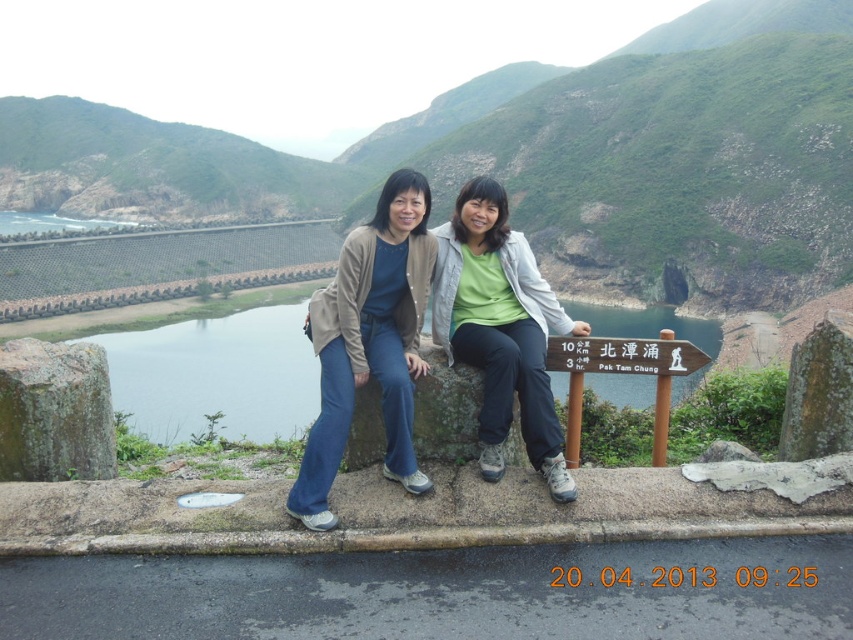
Which is more to the right, green fabric jacket at center or brown wooden signpost at center?

From the viewer's perspective, brown wooden signpost at center appears more on the right side.

Measure the distance from green fabric jacket at center to brown wooden signpost at center.

1.27 meters

Locate an element on the screen. This screenshot has height=640, width=853. green fabric jacket at center is located at coordinates (500, 328).

The width and height of the screenshot is (853, 640). Identify the location of green fabric jacket at center. (500, 328).

Does point (340, 262) come closer to viewer compared to point (83, 472)?

No, it is not.

Between point (540, 339) and point (3, 356), which one is positioned behind?

The point (540, 339) is behind.

Image resolution: width=853 pixels, height=640 pixels. In order to click on denim jeans at center in this screenshot , I will do `click(370, 342)`.

You are a GUI agent. You are given a task and a screenshot of the screen. Output one action in this format:
    pyautogui.click(x=<x>, y=<y>)
    Task: Click on the matte brown cardigan at center
    The height and width of the screenshot is (640, 853).
    Given the screenshot: What is the action you would take?
    pyautogui.click(x=369, y=342)

Does matte brown cardigan at center have a lesser height compared to green mossy rock at left?

No, matte brown cardigan at center is not shorter than green mossy rock at left.

The image size is (853, 640). In order to click on matte brown cardigan at center in this screenshot , I will do `click(369, 342)`.